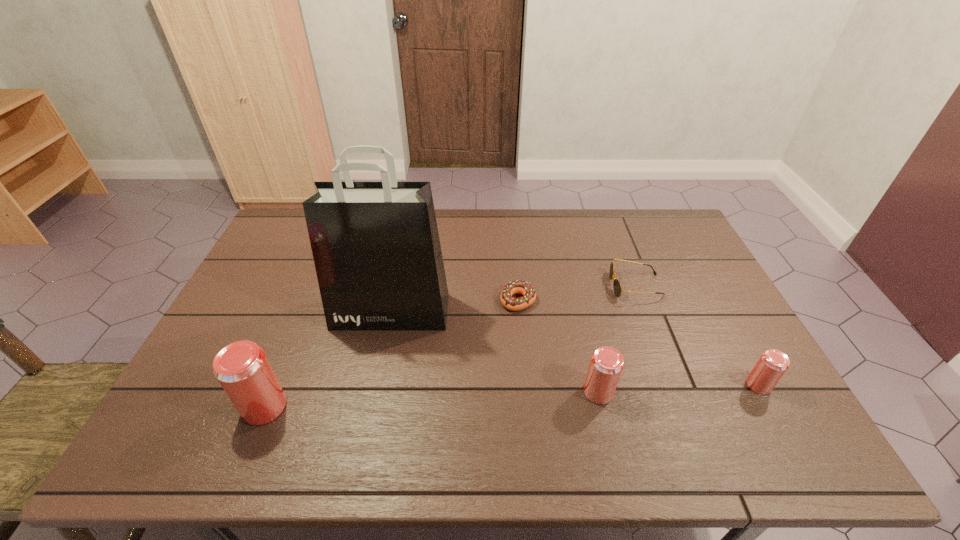
Locate an element on the screen. vacant space located 0.060m on the back of the leftmost object is located at coordinates (280, 369).

This screenshot has width=960, height=540. I want to click on vacant space situated on the left of the second tallest beer can, so click(x=488, y=392).

Locate an element on the screen. The image size is (960, 540). free region located on the back of the fourth tallest object is located at coordinates click(711, 299).

Identify the location of free space located on the front with handles of the tallest object. Image resolution: width=960 pixels, height=540 pixels. (383, 350).

Image resolution: width=960 pixels, height=540 pixels. Identify the location of vacant space located on the front-facing side of the sunglasses. (573, 286).

Locate an element on the screen. vacant space situated 0.320m on the front-facing side of the sunglasses is located at coordinates (509, 286).

This screenshot has width=960, height=540. I want to click on free space located on the front-facing side of the sunglasses, so (544, 286).

Locate an element on the screen. free region located on the back of the third object from left to right is located at coordinates coord(516,275).

Find the location of `object at the right edge`. object at the right edge is located at coordinates (771, 366).

Locate an element on the screen. object located in the near right corner section of the desktop is located at coordinates (771, 366).